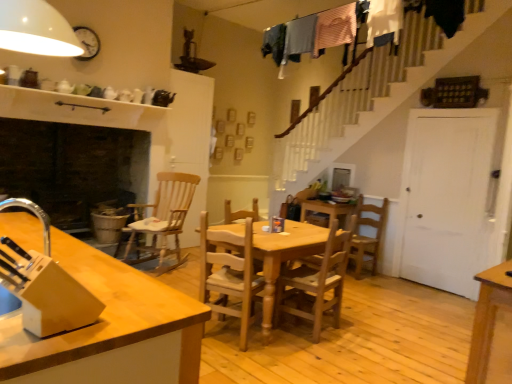
Question: From a real-world perspective, is wooden chair at center, the 3th chair from the left, positioned under wooden table at center based on gravity?

Choices:
 (A) yes
 (B) no

Answer: (B)

Question: From the image's perspective, would you say wooden chair at center, arranged as the 2th chair when viewed from the right, is positioned over wooden table at center?

Choices:
 (A) no
 (B) yes

Answer: (B)

Question: Is wooden chair at center, the second chair positioned from the front, directly adjacent to wooden table at center?

Choices:
 (A) no
 (B) yes

Answer: (A)

Question: Is wooden chair at center, the 3th chair positioned from the back, wider than wooden table at center?

Choices:
 (A) yes
 (B) no

Answer: (B)

Question: Is wooden chair at center, the second chair positioned from the front, far away from wooden table at center?

Choices:
 (A) yes
 (B) no

Answer: (B)

Question: From the image's perspective, does wooden chair at center, the second chair positioned from the front, appear lower than wooden table at center?

Choices:
 (A) yes
 (B) no

Answer: (B)

Question: Considering the relative sizes of wooden rocking chair at center-left, which is counted as the 1th chair, starting from the left, and wooden chair at center, the 3th chair from the left, in the image provided, is wooden rocking chair at center-left, which is counted as the 1th chair, starting from the left, smaller than wooden chair at center, the 3th chair from the left,?

Choices:
 (A) yes
 (B) no

Answer: (B)

Question: Is wooden rocking chair at center-left, which is counted as the 1th chair, starting from the left, closer to camera compared to wooden chair at center, the 3th chair positioned from the back?

Choices:
 (A) yes
 (B) no

Answer: (B)

Question: From the image's perspective, is wooden rocking chair at center-left, the second chair viewed from the back, under wooden chair at center, the 3th chair from the left?

Choices:
 (A) yes
 (B) no

Answer: (B)

Question: Is wooden chair at center, the 3th chair positioned from the back, inside wooden rocking chair at center-left, positioned as the third chair in front-to-back order?

Choices:
 (A) yes
 (B) no

Answer: (B)

Question: Is wooden rocking chair at center-left, which is counted as the 1th chair, starting from the left, not inside wooden chair at center, the second chair positioned from the front?

Choices:
 (A) no
 (B) yes

Answer: (B)

Question: Considering the relative sizes of wooden rocking chair at center-left, the second chair viewed from the back, and wooden chair at center, the 3th chair positioned from the back, in the image provided, is wooden rocking chair at center-left, the second chair viewed from the back, bigger than wooden chair at center, the 3th chair positioned from the back,?

Choices:
 (A) no
 (B) yes

Answer: (B)

Question: Is wooden rocking chair at center-left, positioned as the third chair in front-to-back order, to the left of wooden table at center from the viewer's perspective?

Choices:
 (A) yes
 (B) no

Answer: (A)